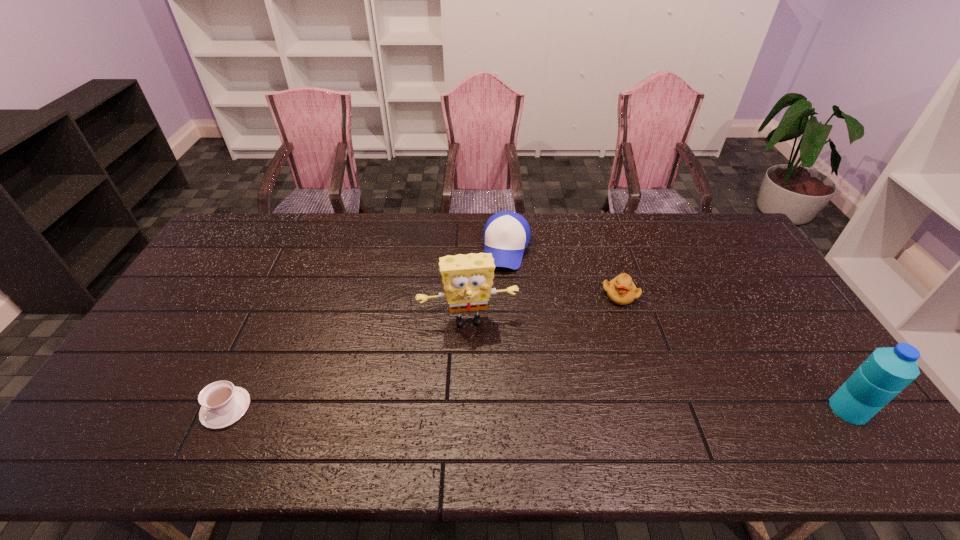
This screenshot has width=960, height=540. Identify the location of teacup. (222, 404).

Locate an element on the screen. the leftmost object is located at coordinates (222, 404).

At what (x,y) coordinates should I click in order to perform the action: click on water bottle. Please return your answer as a coordinate pair (x, y). This screenshot has height=540, width=960. Looking at the image, I should click on (887, 371).

I want to click on the fourth tallest object, so click(x=621, y=290).

Find the location of a particular element. The image size is (960, 540). the second object from right to left is located at coordinates (621, 290).

Identify the location of baseball cap. (506, 234).

At what (x,y) coordinates should I click in order to perform the action: click on the third shortest object. Please return your answer as a coordinate pair (x, y). The width and height of the screenshot is (960, 540). Looking at the image, I should click on coord(506,234).

The height and width of the screenshot is (540, 960). I want to click on sponge, so click(467, 279).

Where is `free point located on the handle side of the shortest object`? free point located on the handle side of the shortest object is located at coordinates (182, 408).

Identify the location of vacant point located 0.130m on the handle side of the shortest object. The height and width of the screenshot is (540, 960). (150, 408).